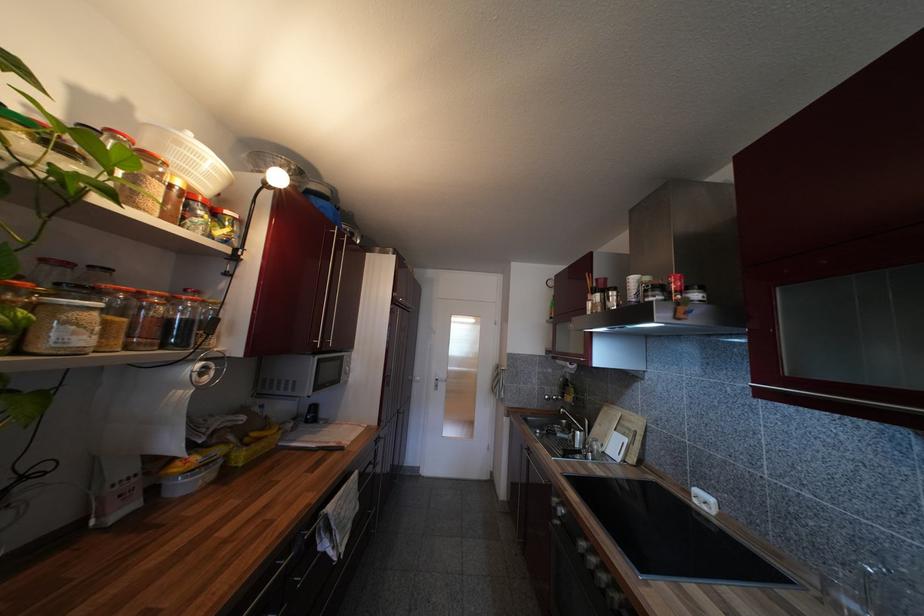
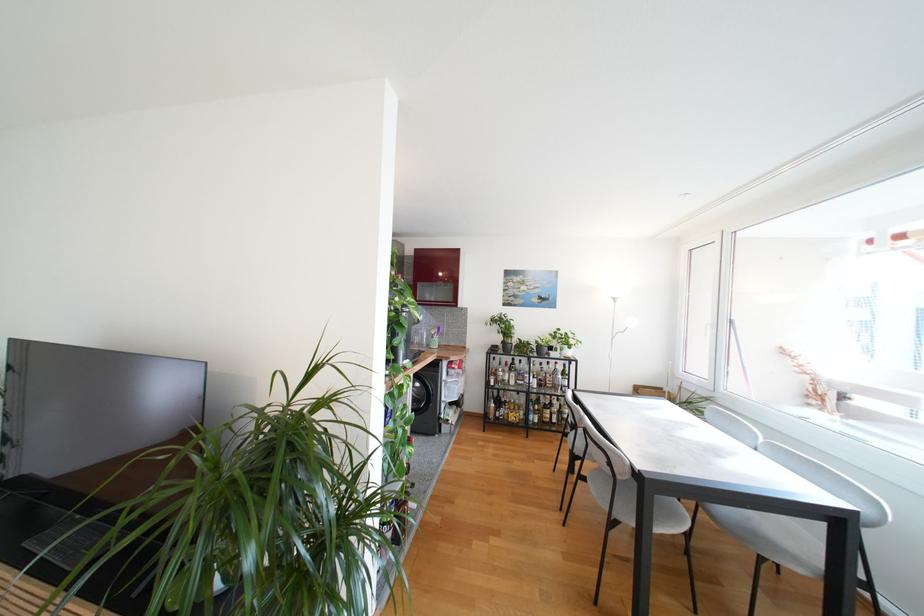
Question: I am providing you with two images of the same scene from different viewpoints. Which of the following objects are not visible in image2?

Choices:
 (A) grey chair sitting surface
 (B) glass jar with lid
 (C) glass food jar
 (D) utensil holder

Answer: (C)